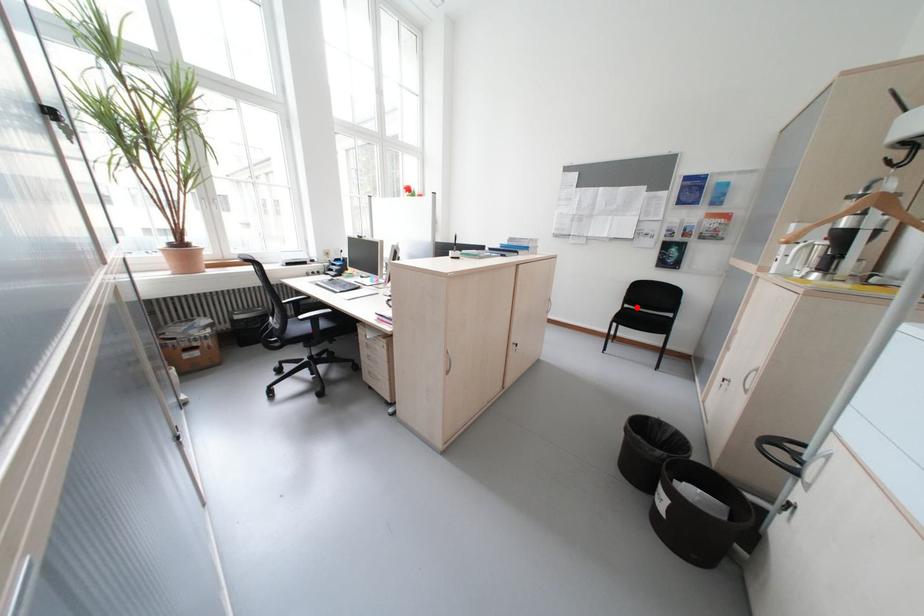
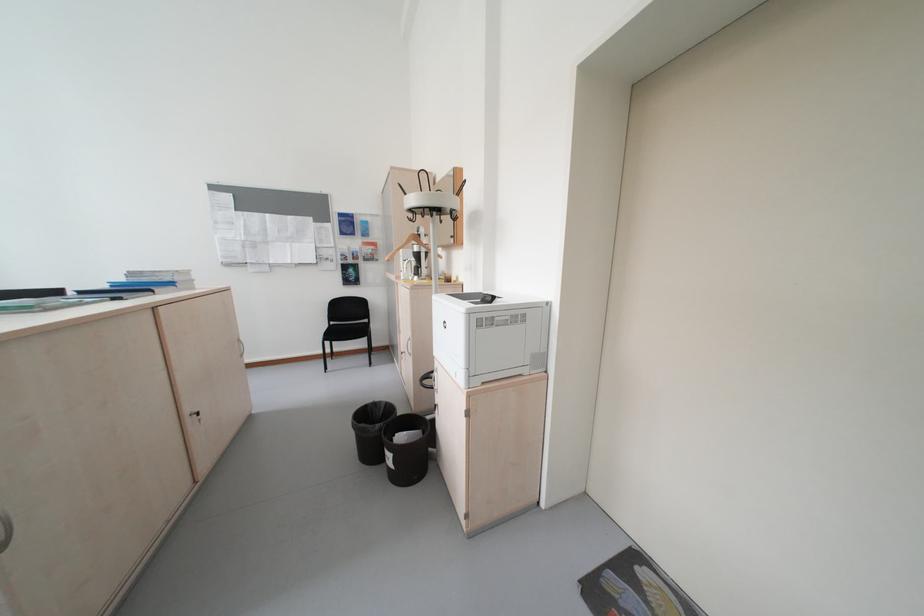
Locate, in the second image, the point that corresponds to the highlighted location in the first image.

(343, 323)